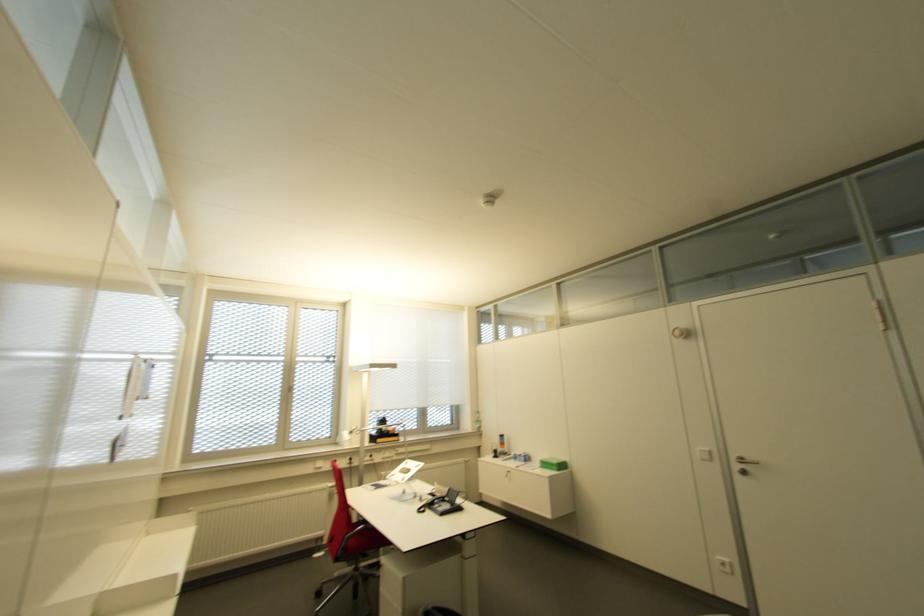
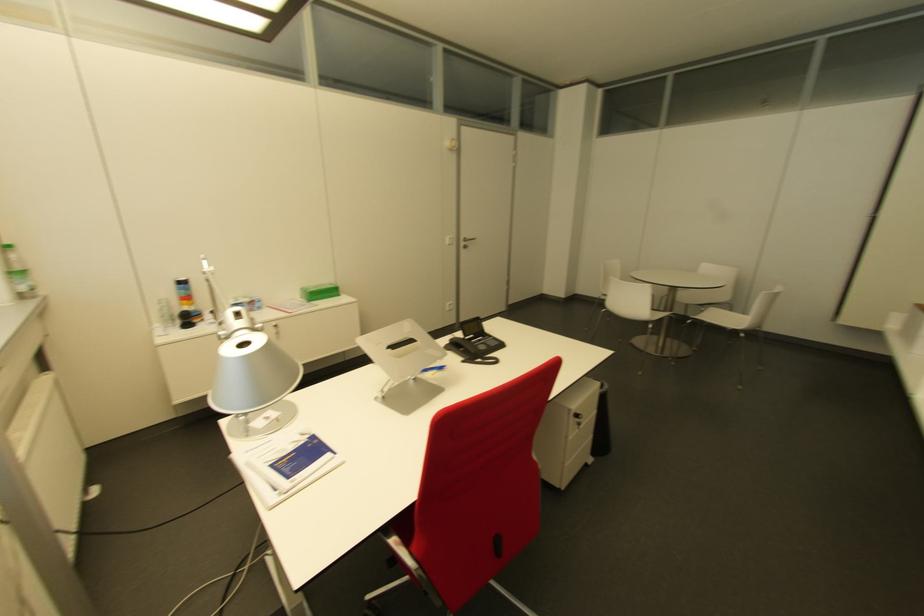
Find the pixel in the second image that matches (x=477, y=426) in the first image.

(27, 284)